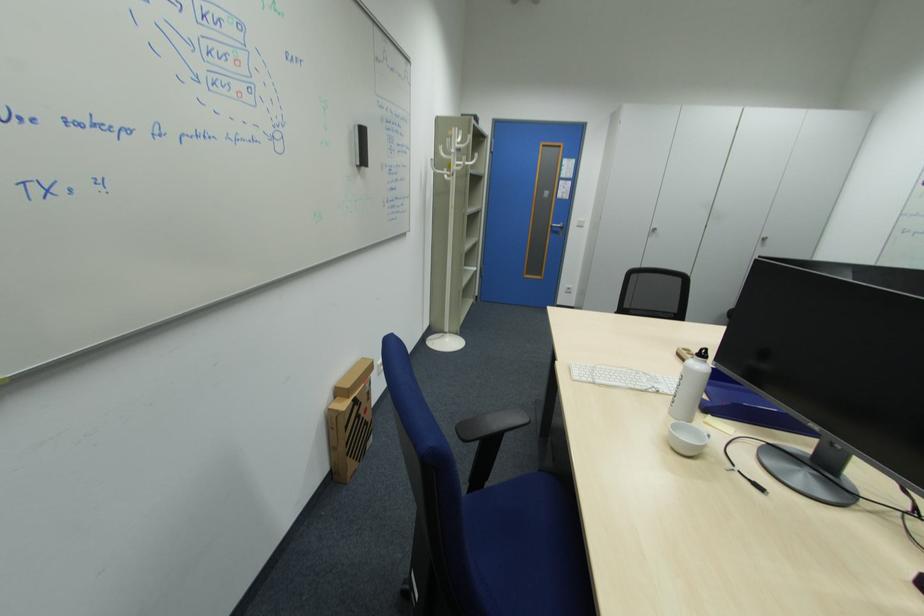
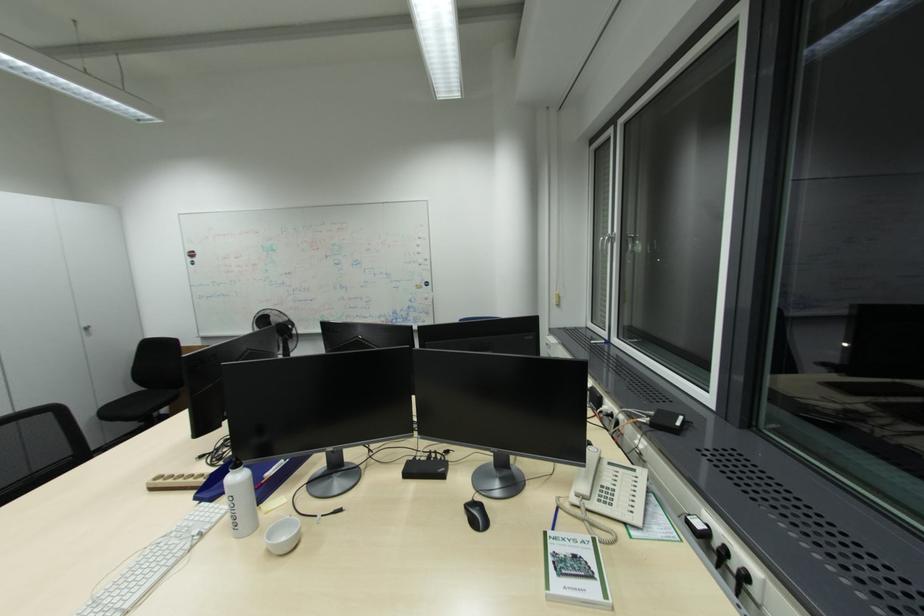
Question: How did the camera likely rotate?

Choices:
 (A) Left
 (B) Right
 (C) Up
 (D) Down

Answer: (B)